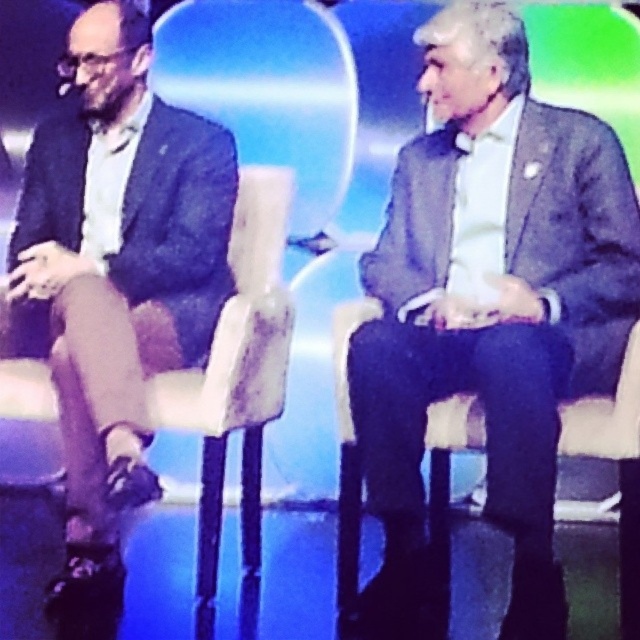
Question: Among these points, which one is nearest to the camera?

Choices:
 (A) (582, 173)
 (B) (64, 225)

Answer: (A)

Question: Among these points, which one is nearest to the camera?

Choices:
 (A) (417, 419)
 (B) (16, 362)
 (C) (161, 240)

Answer: (A)

Question: Which of the following is the closest to the observer?

Choices:
 (A) (390, 536)
 (B) (176, 376)

Answer: (A)

Question: Can you confirm if matte gray suit at center is positioned to the right of dark blue textured suit at left?

Choices:
 (A) no
 (B) yes

Answer: (B)

Question: Can you confirm if matte gray suit at center is positioned above dark blue textured suit at left?

Choices:
 (A) yes
 (B) no

Answer: (B)

Question: Can you confirm if matte gray suit at center is positioned below dark blue textured suit at left?

Choices:
 (A) no
 (B) yes

Answer: (B)